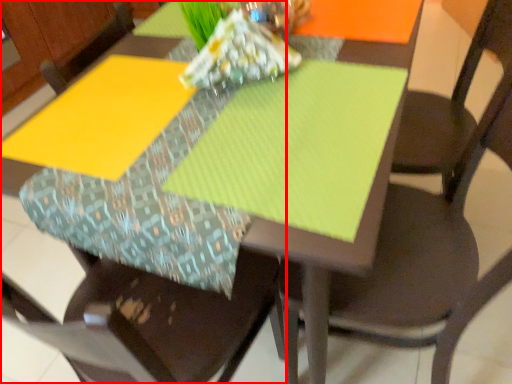
Question: In this image, where is chair (annotated by the red box) located relative to chair?

Choices:
 (A) left
 (B) right

Answer: (A)